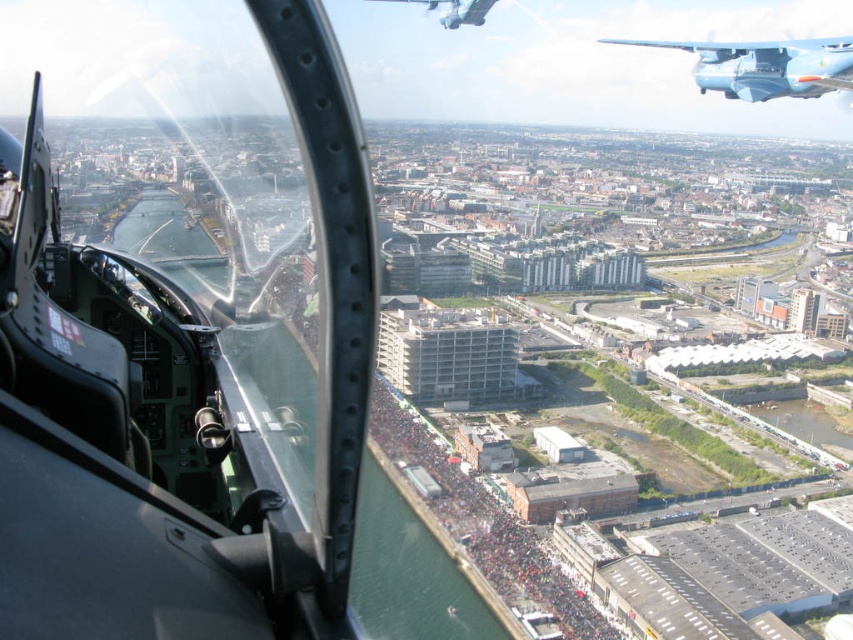
Does blue metallic airplane at upper right have a greater height compared to metallic blue airplane at upper right?

Yes.

Describe the element at coordinates (764, 67) in the screenshot. The height and width of the screenshot is (640, 853). I see `blue metallic airplane at upper right` at that location.

Where is `blue metallic airplane at upper right`? Image resolution: width=853 pixels, height=640 pixels. blue metallic airplane at upper right is located at coordinates (764, 67).